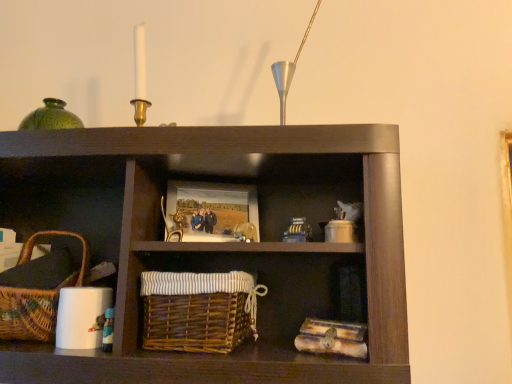
Question: From a real-world perspective, is wooden picture frame at center physically located above or below brown wicker basket at center?

Choices:
 (A) above
 (B) below

Answer: (A)

Question: From the image's perspective, is wooden picture frame at center above or below brown wicker basket at center?

Choices:
 (A) below
 (B) above

Answer: (B)

Question: Which object is the farthest from the wooden picture frame at center?

Choices:
 (A) woven brown picnic basket at lower left
 (B) brown wicker basket at center

Answer: (A)

Question: Based on their relative distances, which object is farther from the brown wicker basket at center?

Choices:
 (A) woven brown picnic basket at lower left
 (B) wooden picture frame at center

Answer: (A)